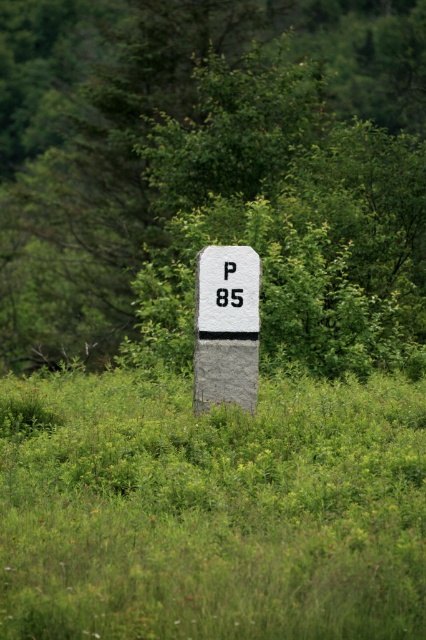
You are a gardener trying to place a new black plastic number at center. You want to ensure it is visible from a distance. Should you place it closer to or farther from the green leafy tree at center?

The green leafy tree at center might be wider than the black plastic number at center, so placing the black plastic number at center farther away from the tree would help it remain visible.

You are standing at the edge of the field near the stone marker. You want to walk directly towards the green leafy tree at center. What direction should you head in?

The green leafy tree at center is located at point coordinates, so you should head towards the center of the field to reach it.